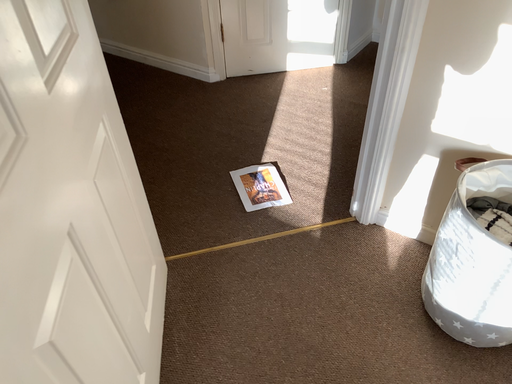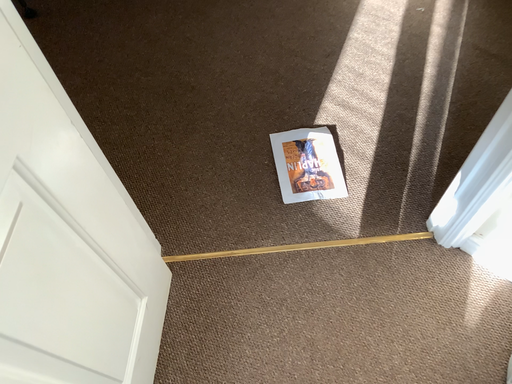
Question: Which way did the camera rotate in the video?

Choices:
 (A) rotated downward
 (B) rotated upward

Answer: (A)